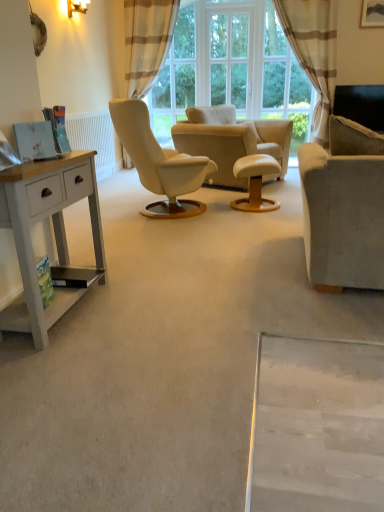
Question: Does light gray fabric couch at right turn towards white painted radiator at left?

Choices:
 (A) no
 (B) yes

Answer: (A)

Question: Can you confirm if light gray fabric couch at right is positioned to the right of white painted radiator at left?

Choices:
 (A) yes
 (B) no

Answer: (A)

Question: Would you consider light gray fabric couch at right to be distant from white painted radiator at left?

Choices:
 (A) yes
 (B) no

Answer: (A)

Question: Can you confirm if light gray fabric couch at right is shorter than white painted radiator at left?

Choices:
 (A) yes
 (B) no

Answer: (B)

Question: Can white painted radiator at left be found inside light gray fabric couch at right?

Choices:
 (A) no
 (B) yes

Answer: (A)

Question: Considering their positions, is white painted wood desk at left located in front of or behind wooden picture frame at upper right?

Choices:
 (A) front
 (B) behind

Answer: (A)

Question: Considering the positions of white painted wood desk at left and wooden picture frame at upper right in the image, is white painted wood desk at left wider or thinner than wooden picture frame at upper right?

Choices:
 (A) thin
 (B) wide

Answer: (B)

Question: From a real-world perspective, is white painted wood desk at left above or below wooden picture frame at upper right?

Choices:
 (A) above
 (B) below

Answer: (B)

Question: Considering the positions of point (34, 298) and point (375, 8), is point (34, 298) closer or farther from the camera than point (375, 8)?

Choices:
 (A) closer
 (B) farther

Answer: (A)

Question: Do you think light gray fabric couch at right is within white painted radiator at left, or outside of it?

Choices:
 (A) outside
 (B) inside

Answer: (A)

Question: Is light gray fabric couch at right in front of or behind white painted radiator at left in the image?

Choices:
 (A) behind
 (B) front

Answer: (B)

Question: Considering the positions of light gray fabric couch at right and white painted radiator at left in the image, is light gray fabric couch at right wider or thinner than white painted radiator at left?

Choices:
 (A) thin
 (B) wide

Answer: (B)

Question: Visually, is light gray fabric couch at right positioned to the left or to the right of white painted radiator at left?

Choices:
 (A) right
 (B) left

Answer: (A)

Question: Would you say light gray fabric couch at right is inside or outside beige striped curtain at upper center?

Choices:
 (A) outside
 (B) inside

Answer: (A)

Question: Considering the positions of light gray fabric couch at right and beige striped curtain at upper center in the image, is light gray fabric couch at right taller or shorter than beige striped curtain at upper center?

Choices:
 (A) short
 (B) tall

Answer: (A)